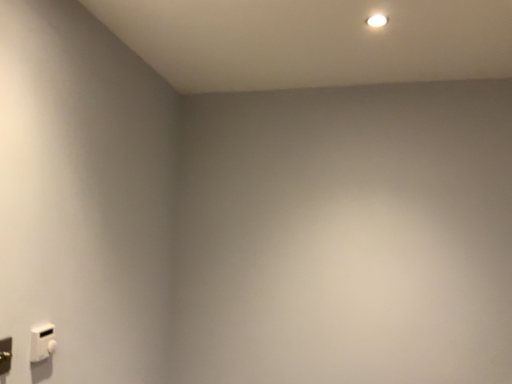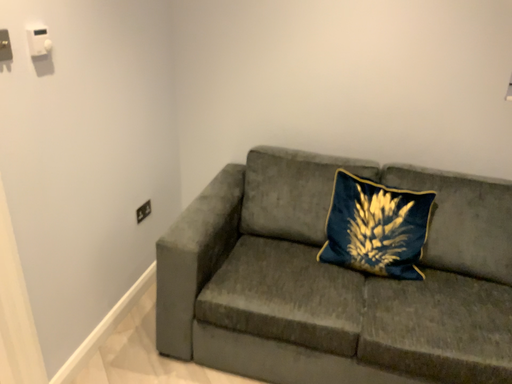
Question: How did the camera likely rotate when shooting the video?

Choices:
 (A) rotated downward
 (B) rotated upward

Answer: (A)